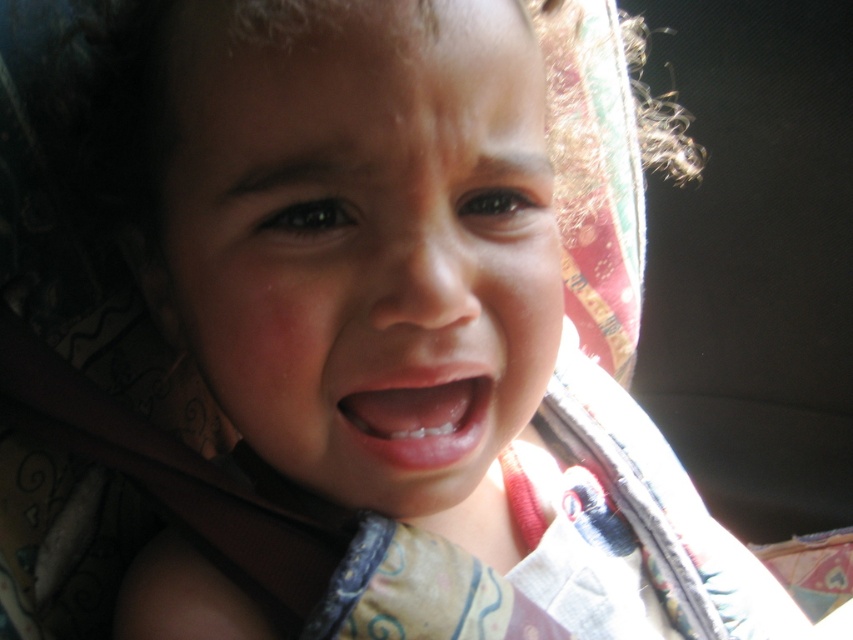
You are a photographer adjusting the focus of your camera. The subject is a child with a smooth skin face at center. If you want to ensure the child remains in focus while capturing the background details, what adjustment should you make to the camera settings?

To keep the child with the smooth skin face at center in focus while capturing background details, you should increase the depth of field by using a smaller aperture setting. This will allow both the subject and background to be clearer.

Based on the scene description, which object is positioned higher on the child? The smooth skin face at center or the pink glossy lips at center?

The smooth skin face at center is located above the pink glossy lips at center, so the smooth skin face at center is positioned higher.